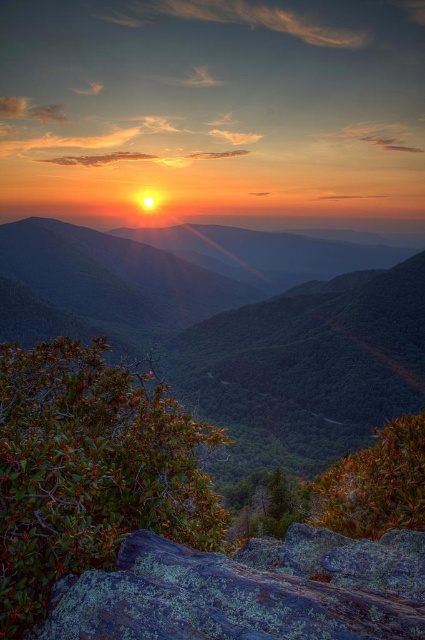
Between point (306, 381) and point (190, 570), which one is positioned in front?

Positioned in front is point (190, 570).

Is green leafy mountain at center bigger than green mossy rock at lower center?

Correct, green leafy mountain at center is larger in size than green mossy rock at lower center.

Does point (419, 358) come behind point (234, 600)?

Yes, point (419, 358) is farther from viewer.

Find the location of a particular element. The height and width of the screenshot is (640, 425). green leafy mountain at center is located at coordinates (248, 328).